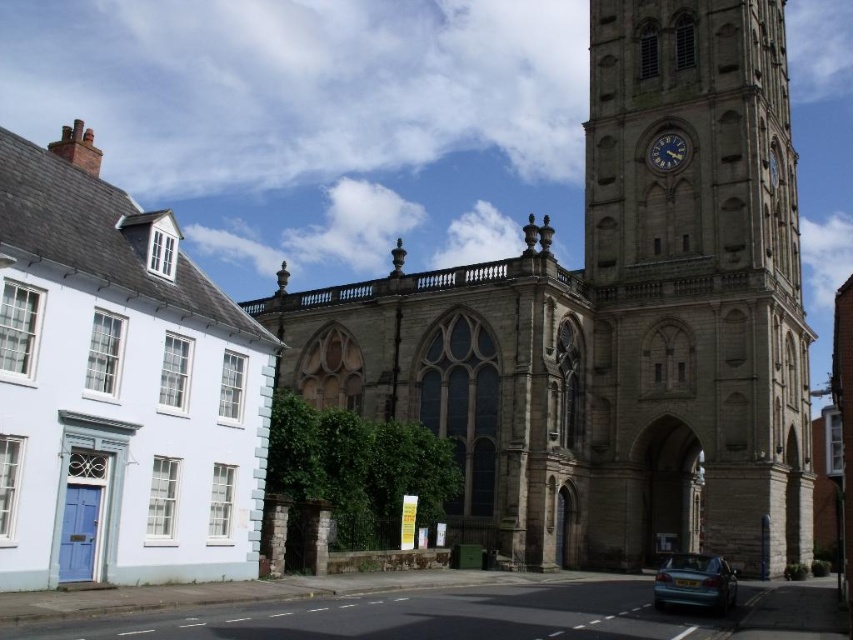
Is teal matte car at lower right above metallic clock face at upper center?

Actually, teal matte car at lower right is below metallic clock face at upper center.

Does teal matte car at lower right have a lesser width compared to metallic clock face at upper center?

No, teal matte car at lower right is not thinner than metallic clock face at upper center.

Which is in front, point (718, 598) or point (677, 141)?

Point (718, 598) is more forward.

In order to click on teal matte car at lower right in this screenshot , I will do pyautogui.click(x=695, y=582).

Between stone clock tower at right and teal matte car at lower right, which one appears on the left side from the viewer's perspective?

teal matte car at lower right

Which is below, stone clock tower at right or teal matte car at lower right?

teal matte car at lower right is below.

Between point (775, 28) and point (659, 584), which one is positioned in front?

Point (659, 584)

Locate an element on the screen. stone clock tower at right is located at coordinates (694, 285).

Who is positioned more to the left, stone church at center or stone clock tower at right?

stone church at center is more to the left.

Is stone church at center in front of stone clock tower at right?

Yes, it is in front of stone clock tower at right.

Who is more forward, (x=343, y=390) or (x=741, y=515)?

Point (x=741, y=515) is in front.

Locate an element on the screen. stone church at center is located at coordinates (612, 321).